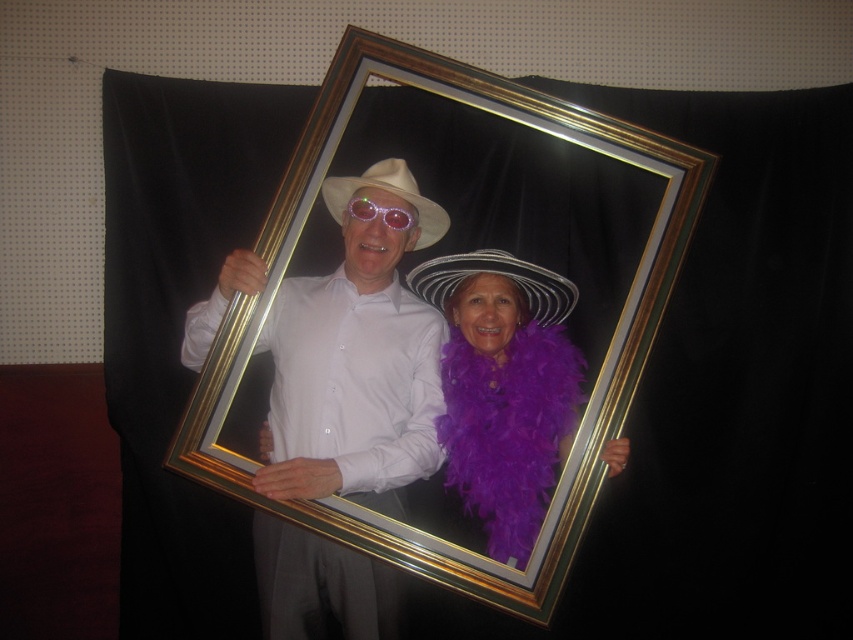
Question: Is matte white shirt at center above purple feather boa at center?

Choices:
 (A) no
 (B) yes

Answer: (B)

Question: Can you confirm if matte white shirt at center is positioned below black straw cowboy hat at center?

Choices:
 (A) no
 (B) yes

Answer: (B)

Question: Considering the real-world distances, which object is farthest from the gold metallic picture frame at center?

Choices:
 (A) translucent plastic goggles at center
 (B) black straw cowboy hat at center
 (C) purple feather boa at center

Answer: (A)

Question: Which object is positioned closest to the purple feather boa at center?

Choices:
 (A) black straw cowboy hat at center
 (B) gold metallic picture frame at center
 (C) translucent plastic goggles at center
 (D) white matte cowboy hat at center

Answer: (A)

Question: Which object is positioned farthest from the translucent plastic goggles at center?

Choices:
 (A) black straw cowboy hat at center
 (B) white matte cowboy hat at center
 (C) gold metallic picture frame at center
 (D) purple feather boa at center

Answer: (D)

Question: Does purple feather boa at center have a greater width compared to white matte cowboy hat at center?

Choices:
 (A) yes
 (B) no

Answer: (A)